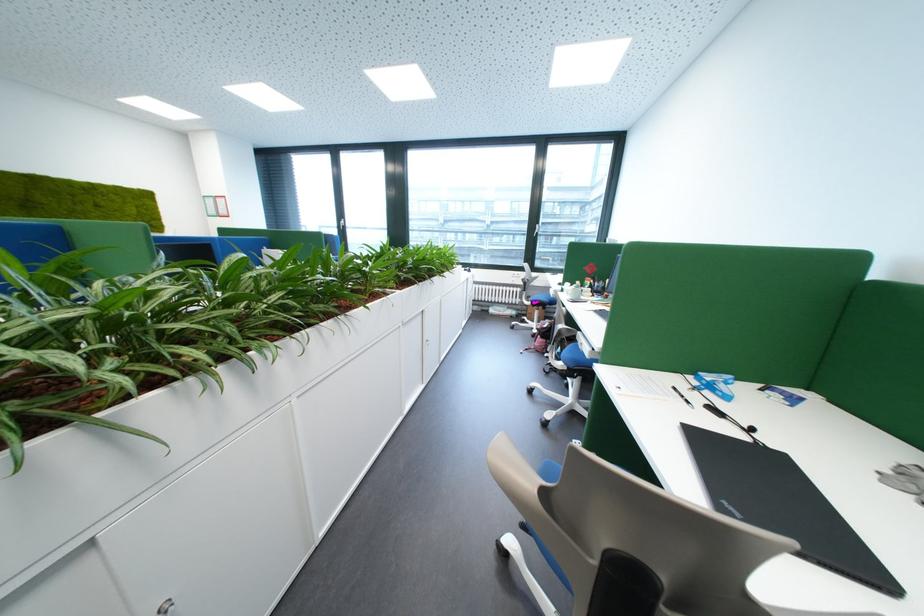
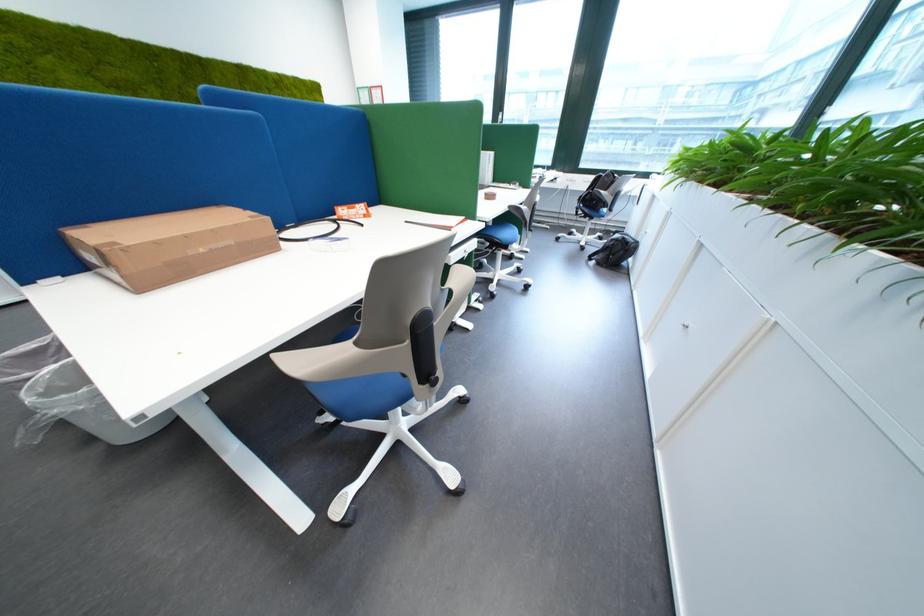
Question: In a continuous first-person perspective shot, in which direction is the camera moving?

Choices:
 (A) Left
 (B) Right
 (C) Forward
 (D) Backward

Answer: (A)